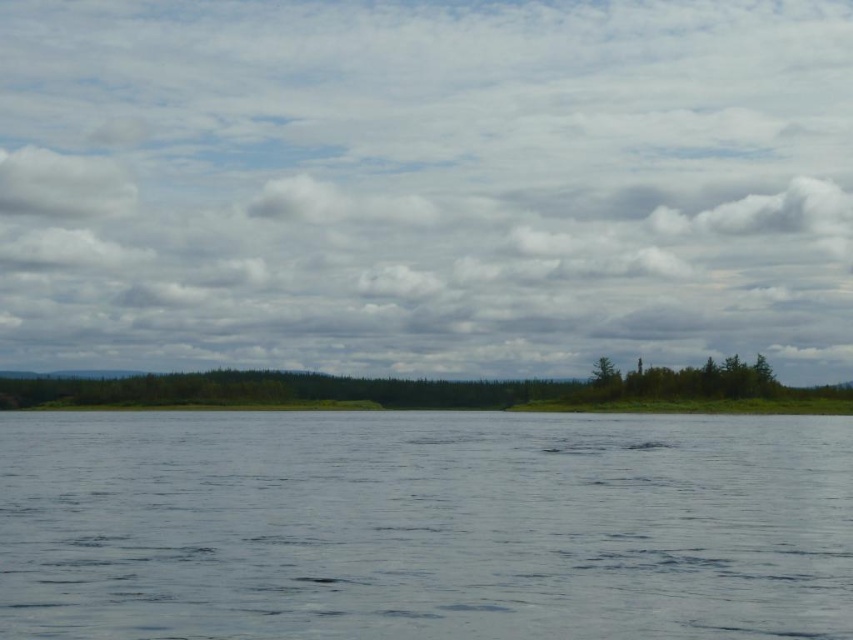
You are standing at the edge of the landscape and want to take a photo of both the clear water at center and the green matte trees at center. Which object should you focus on first to ensure both are in sharp focus?

You should focus on the green matte trees at center first because they are farther away than the clear water at center. By focusing on the farther object, the closer object will also be in focus due to the depth of field.

You are standing on the edge of the water and want to see which object is closer to the sky. Based on the scene, which one is closer to the sky between the clear water at center and the green matte trees at center?

The clear water at center is shorter than the green matte trees at center, so the green matte trees at center are closer to the sky.

You are standing on the bank of the lake and want to reach the green matte trees at center across the clear water at center. If your boat can travel 100 feet, will you be able to reach the trees?

The distance between the clear water at center and green matte trees at center is 135.99 feet. Since your boat can travel 100 feet, you will not be able to reach the green matte trees at center as the distance exceeds the boat capacity.